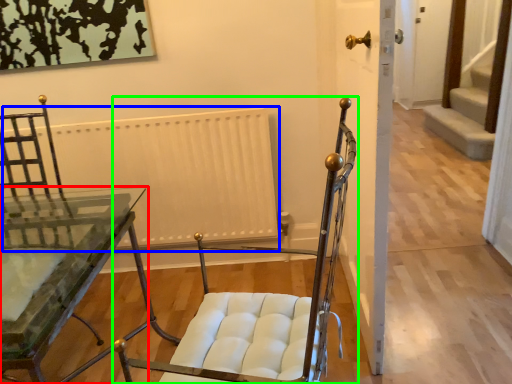
Question: Considering the real-world distances, which object is farthest from table (highlighted by a red box)? radiator (highlighted by a blue box) or chair (highlighted by a green box)?

Choices:
 (A) radiator
 (B) chair

Answer: (B)